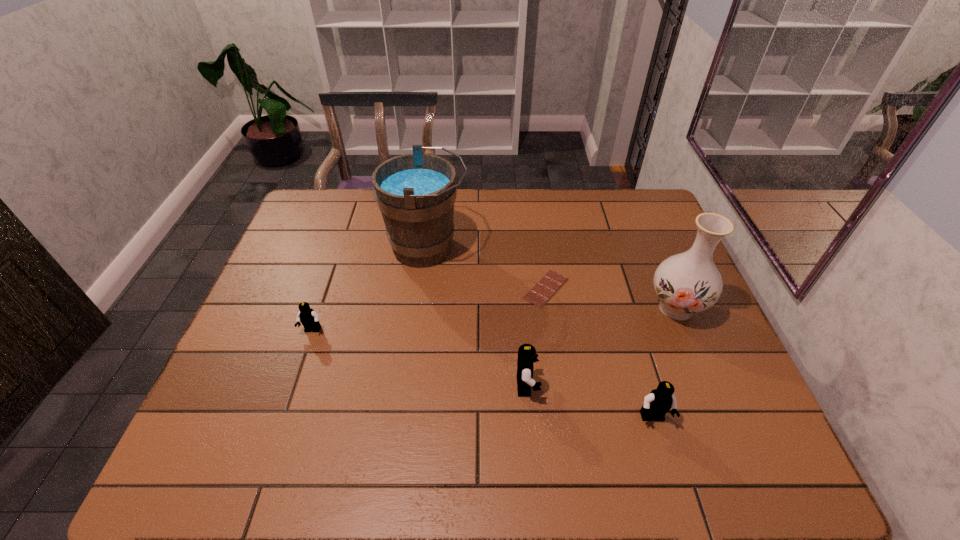
Identify the location of the leftmost object. The image size is (960, 540). (307, 316).

You are a GUI agent. You are given a task and a screenshot of the screen. Output one action in this format:
    pyautogui.click(x=<x>, y=<y>)
    Task: Click on the fifth tallest object
    The height and width of the screenshot is (540, 960).
    Given the screenshot: What is the action you would take?
    pyautogui.click(x=307, y=316)

The width and height of the screenshot is (960, 540). In order to click on the second farthest Lego in this screenshot , I will do `click(527, 355)`.

You are a GUI agent. You are given a task and a screenshot of the screen. Output one action in this format:
    pyautogui.click(x=<x>, y=<y>)
    Task: Click on the tallest Lego
    
    Given the screenshot: What is the action you would take?
    pyautogui.click(x=527, y=355)

You are a GUI agent. You are given a task and a screenshot of the screen. Output one action in this format:
    pyautogui.click(x=<x>, y=<y>)
    Task: Click on the second object from right to left
    
    Given the screenshot: What is the action you would take?
    pos(656,404)

Image resolution: width=960 pixels, height=540 pixels. Identify the location of the third shortest object. (656, 404).

Where is `the shortest object`? the shortest object is located at coordinates (551, 282).

This screenshot has height=540, width=960. I want to click on wine bucket, so click(415, 193).

At what (x,y) coordinates should I click in order to perform the action: click on the rightmost object. Please return your answer as a coordinate pair (x, y). Looking at the image, I should click on (689, 282).

Locate an element on the screen. The image size is (960, 540). free space located on the front-facing side of the leftmost Lego is located at coordinates (301, 362).